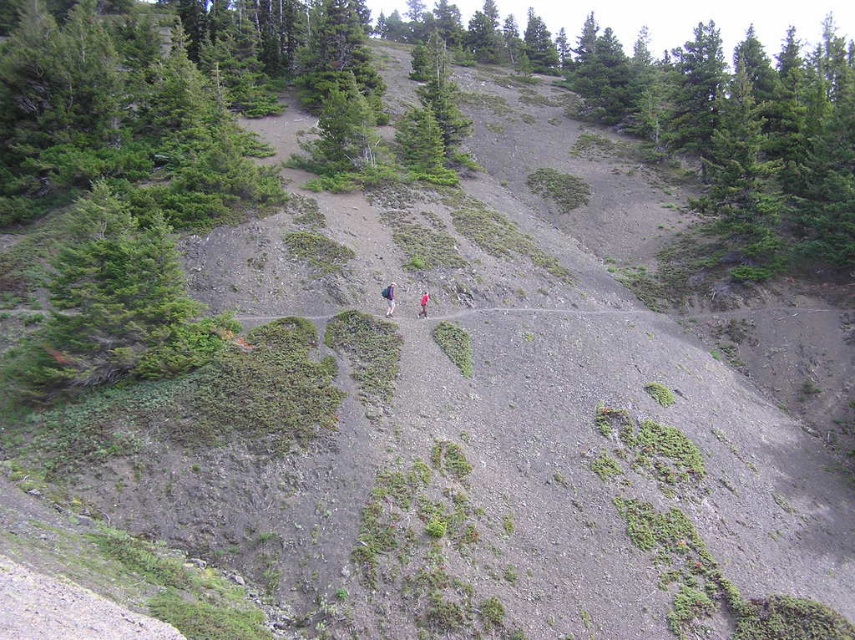
You are a hiker planning to carry both the purple fabric backpack at center and the pink fabric at center. Which one can hold more items?

The purple fabric backpack at center is bigger than the pink fabric at center, so it can hold more items.

You are a hiker navigating a mountain trail and notice a green textured shrub at left. Based on its position, can you determine if the shrub is closer to the top or the bottom of the slope?

The green textured shrub at left is located at point 0.477 on the x axis and 0.135 on the y axis. Since the y coordinate is closer to 0, which typically represents the bottom of the slope, the shrub is closer to the bottom of the slope.

You are a hiker carrying a purple fabric backpack at center and need to navigate towards a green textured shrub at left. Given that the shrub is 40.22 feet away, can you estimate how many minutes it would take to reach it if you walk at a moderate pace of 3 miles per hour?

The green textured shrub at left is 40.22 feet away from the purple fabric backpack at center. At a moderate pace of 3 miles per hour, it would take approximately 0.25 minutes to reach the shrub.